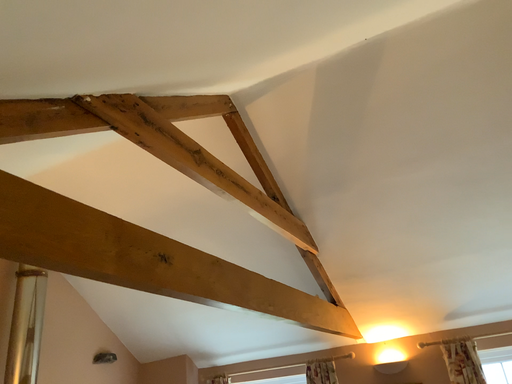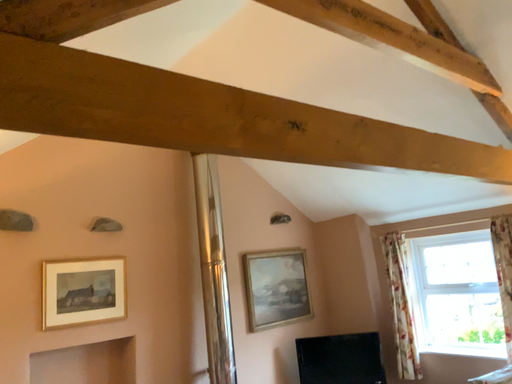
Question: How did the camera likely rotate when shooting the video?

Choices:
 (A) rotated left
 (B) rotated right

Answer: (A)